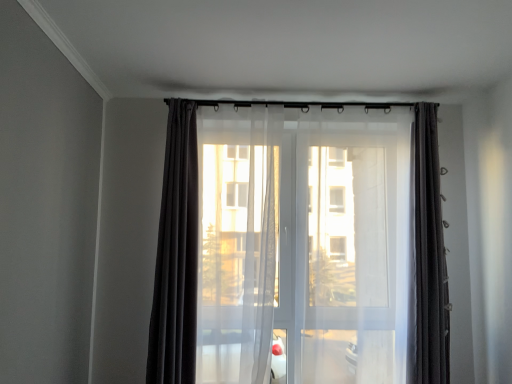
Question: Is transparent fabric screen door at center facing away from sheer white curtain at center, the 2th curtain when ordered from left to right?

Choices:
 (A) yes
 (B) no

Answer: (A)

Question: Does transparent fabric screen door at center touch sheer white curtain at center, positioned as the 2th curtain in right-to-left order?

Choices:
 (A) yes
 (B) no

Answer: (B)

Question: Is transparent fabric screen door at center positioned behind sheer white curtain at center, the 2th curtain when ordered from left to right?

Choices:
 (A) yes
 (B) no

Answer: (B)

Question: Does transparent fabric screen door at center have a greater width compared to sheer white curtain at center, the 2th curtain when ordered from left to right?

Choices:
 (A) yes
 (B) no

Answer: (B)

Question: From a real-world perspective, is transparent fabric screen door at center below sheer white curtain at center, positioned as the 2th curtain in right-to-left order?

Choices:
 (A) no
 (B) yes

Answer: (A)

Question: Considering the positions of transparent fabric screen door at center and matte black curtain at center, which is the 3th curtain in left-to-right order, in the image, is transparent fabric screen door at center wider or thinner than matte black curtain at center, which is the 3th curtain in left-to-right order,?

Choices:
 (A) wide
 (B) thin

Answer: (A)

Question: Visually, is transparent fabric screen door at center positioned to the left or to the right of matte black curtain at center, which is the 3th curtain in left-to-right order?

Choices:
 (A) right
 (B) left

Answer: (B)

Question: In the image, is transparent fabric screen door at center positioned in front of or behind matte black curtain at center, the first curtain viewed from the right?

Choices:
 (A) behind
 (B) front

Answer: (B)

Question: In terms of size, does transparent fabric screen door at center appear bigger or smaller than matte black curtain at center, which is the 3th curtain in left-to-right order?

Choices:
 (A) big
 (B) small

Answer: (A)

Question: Do you think sheer white curtain at center, the 2th curtain when ordered from left to right, is within matte black curtain at center, which is the 3th curtain in left-to-right order, or outside of it?

Choices:
 (A) outside
 (B) inside

Answer: (A)

Question: From the image's perspective, is sheer white curtain at center, positioned as the 2th curtain in right-to-left order, above or below matte black curtain at center, which is the 3th curtain in left-to-right order?

Choices:
 (A) above
 (B) below

Answer: (B)

Question: Does point (436, 160) appear closer or farther from the camera than point (414, 248)?

Choices:
 (A) farther
 (B) closer

Answer: (A)

Question: Considering the positions of sheer white curtain at center, positioned as the 2th curtain in right-to-left order, and matte black curtain at center, the first curtain viewed from the right, in the image, is sheer white curtain at center, positioned as the 2th curtain in right-to-left order, wider or thinner than matte black curtain at center, the first curtain viewed from the right,?

Choices:
 (A) thin
 (B) wide

Answer: (B)

Question: From a real-world perspective, relative to matte black curtain at center, which is the 3th curtain in left-to-right order, is matte black curtain at center, which ranks as the third curtain in right-to-left order, vertically above or below?

Choices:
 (A) below
 (B) above

Answer: (A)

Question: In the image, is matte black curtain at center, acting as the first curtain starting from the left, on the left side or the right side of matte black curtain at center, the first curtain viewed from the right?

Choices:
 (A) left
 (B) right

Answer: (A)